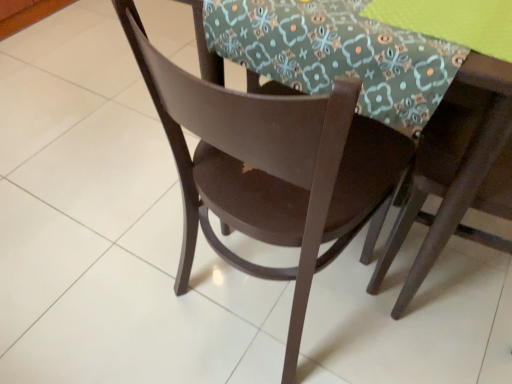
The height and width of the screenshot is (384, 512). Identify the location of free region on the left part of matte brown chair at center, which is the 2th chair from right to left. (132, 277).